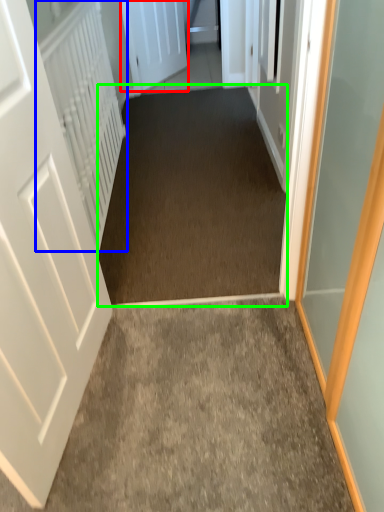
Question: Estimate the real-world distances between objects in this image. Which object is closer to door (highlighted by a red box), radiator (highlighted by a blue box) or corridor (highlighted by a green box)?

Choices:
 (A) radiator
 (B) corridor

Answer: (B)